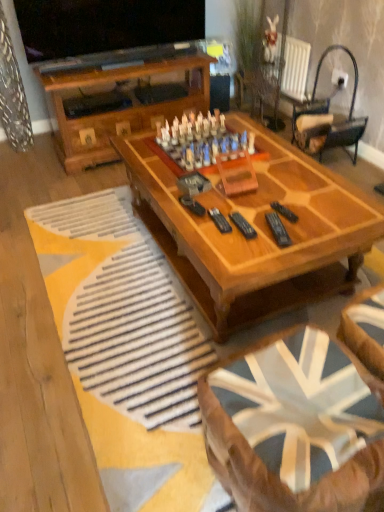
Locate an element on the screen. The height and width of the screenshot is (512, 384). vacant space situated on the left part of black plastic remote at center, arranged as the second remote when viewed from the right is located at coordinates (233, 234).